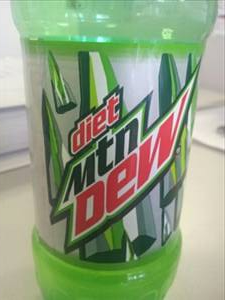
Locate an element on the screen. The image size is (225, 300). green bottle is located at coordinates (107, 283).